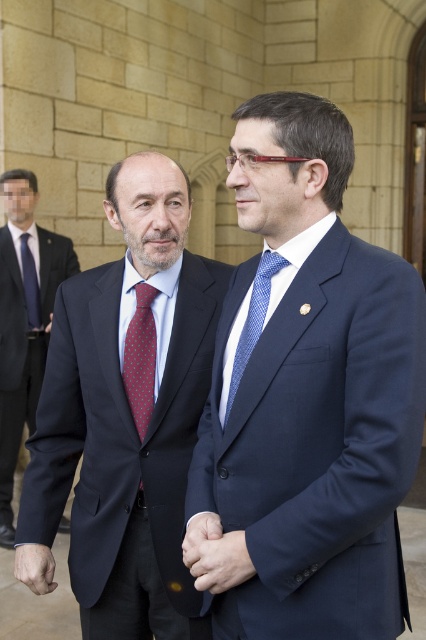
You are a photographer who wants to capture a closeup shot of the blue dotted tie at center and the smooth skin hand at center. Based on their positions, which object is closer to the right edge of the frame?

The blue dotted tie at center is positioned on the right side of smooth skin hand at center, so the blue dotted tie at center is closer to the right edge of the frame.

You are a photographer trying to capture a closeup of the red dotted tie at center and the dark skin hand at center. Since you want to focus on both objects equally, which one should you position closer to the center of your camera frame?

The red dotted tie at center is already positioned to the right of the dark skin hand at center, so to focus on both equally, you should center the frame between them, ensuring both are visible and balanced.

You are a photographer trying to capture a clear shot of both the blue textured suit at center and the blue dotted tie at center. Since you want to ensure both are visible in the frame, which object should you position closer to the camera to avoid overlap?

The blue dotted tie at center should be positioned closer to the camera because the blue textured suit at center is to the right of it, so moving the tie forward would prevent overlap while keeping both in view.